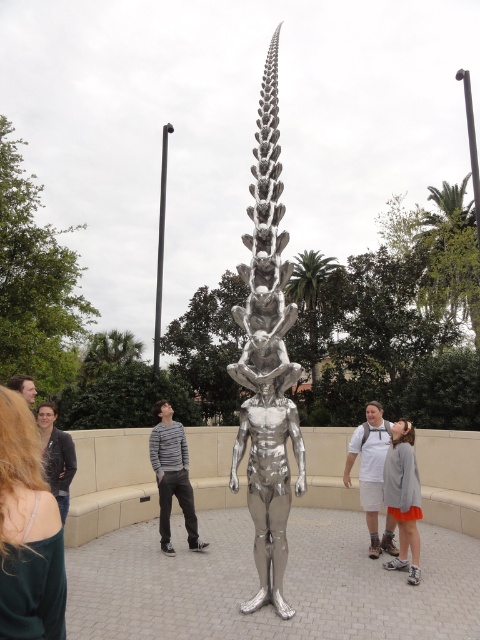
You are an artist planning to paint the sculpture in the park. You notice the green fabric dress at lower left and the gray sweater at center. Which clothing item takes up more visual space in the painting?

The gray sweater at center occupies more visual space than the green fabric dress at lower left.